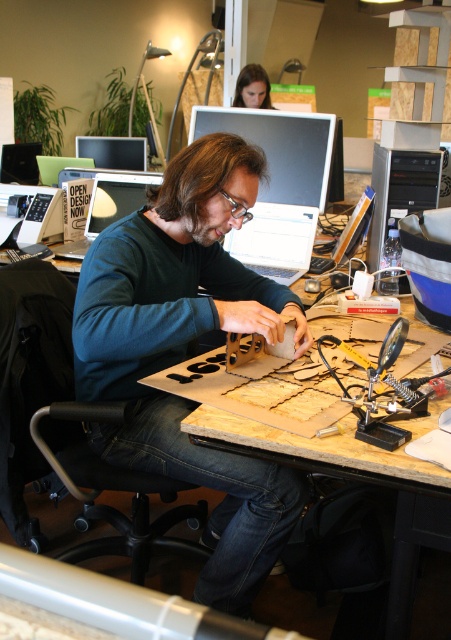
You are standing in front of the workspace and want to reach the matte black laptop at upper center. If your outstretched arm can reach 2 meters, will you be able to touch it without moving?

The matte black laptop at upper center is 2.17 meters away from the camera, which is slightly beyond your 2 meter reach. You would need to take a step forward to touch it.